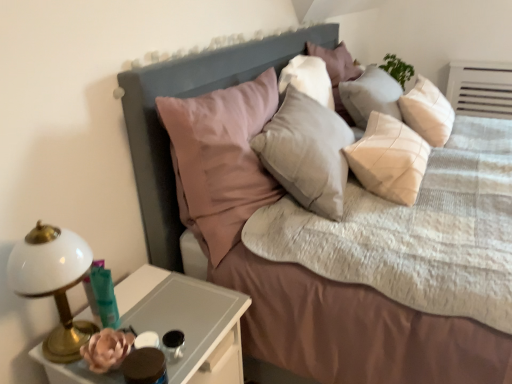
Question: Are white glossy nightstand at lower left and matte gray headboard at upper center far apart?

Choices:
 (A) yes
 (B) no

Answer: (B)

Question: From the image's perspective, is white glossy nightstand at lower left on top of matte gray headboard at upper center?

Choices:
 (A) yes
 (B) no

Answer: (B)

Question: Is white glossy nightstand at lower left further to the viewer compared to matte gray headboard at upper center?

Choices:
 (A) yes
 (B) no

Answer: (B)

Question: Can we say white glossy nightstand at lower left lies outside matte gray headboard at upper center?

Choices:
 (A) no
 (B) yes

Answer: (B)

Question: Does white glossy nightstand at lower left have a lesser height compared to matte gray headboard at upper center?

Choices:
 (A) no
 (B) yes

Answer: (A)

Question: Considering the relative sizes of white glossy nightstand at lower left and matte gray headboard at upper center in the image provided, is white glossy nightstand at lower left smaller than matte gray headboard at upper center?

Choices:
 (A) no
 (B) yes

Answer: (B)

Question: Does white glossy bedside lamp at left have a larger size compared to matte gray headboard at upper center?

Choices:
 (A) yes
 (B) no

Answer: (B)

Question: Is the depth of white glossy bedside lamp at left less than that of matte gray headboard at upper center?

Choices:
 (A) no
 (B) yes

Answer: (B)

Question: Is white glossy bedside lamp at left facing towards matte gray headboard at upper center?

Choices:
 (A) no
 (B) yes

Answer: (A)

Question: From the image's perspective, is white glossy bedside lamp at left below matte gray headboard at upper center?

Choices:
 (A) no
 (B) yes

Answer: (B)

Question: Does white glossy bedside lamp at left have a greater width compared to matte gray headboard at upper center?

Choices:
 (A) yes
 (B) no

Answer: (B)

Question: Is white glossy bedside lamp at left further to camera compared to matte gray headboard at upper center?

Choices:
 (A) yes
 (B) no

Answer: (B)

Question: Is black glass candle holder at lower left, arranged as the 1th candle holder when viewed from the right, positioned with its back to white glossy bedside lamp at left?

Choices:
 (A) no
 (B) yes

Answer: (B)